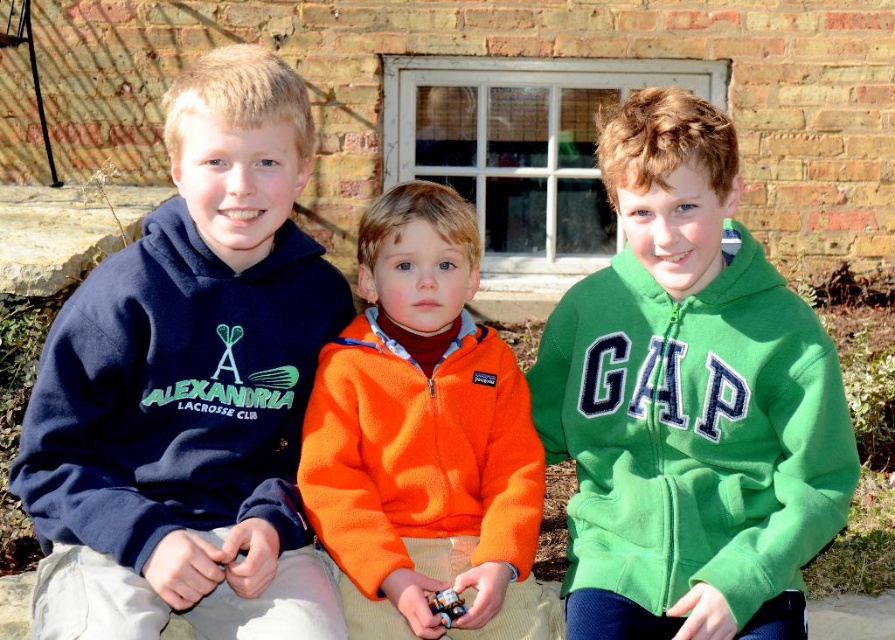
Is green fleece jacket at center further to camera compared to orange fleece jacket at center?

Yes.

Does green fleece jacket at center appear over orange fleece jacket at center?

Indeed, green fleece jacket at center is positioned over orange fleece jacket at center.

Which is behind, point (808, 452) or point (419, 552)?

The point (419, 552) is more distant.

The image size is (895, 640). Find the location of `green fleece jacket at center`. green fleece jacket at center is located at coordinates pos(688,401).

From the picture: Who is lower down, navy fleece hoodie at left or green fleece jacket at center?

Answer: green fleece jacket at center is lower down.

Is point (186, 259) more distant than point (731, 477)?

Yes, it is.

You are a GUI agent. You are given a task and a screenshot of the screen. Output one action in this format:
    pyautogui.click(x=<x>, y=<y>)
    Task: Click on the navy fleece hoodie at left
    Image resolution: width=895 pixels, height=640 pixels.
    Given the screenshot: What is the action you would take?
    pyautogui.click(x=190, y=388)

Does navy fleece hoodie at left have a smaller size compared to orange fleece jacket at center?

Actually, navy fleece hoodie at left might be larger than orange fleece jacket at center.

Is navy fleece hoodie at left shorter than orange fleece jacket at center?

No, navy fleece hoodie at left is not shorter than orange fleece jacket at center.

Image resolution: width=895 pixels, height=640 pixels. Identify the location of navy fleece hoodie at left. (190, 388).